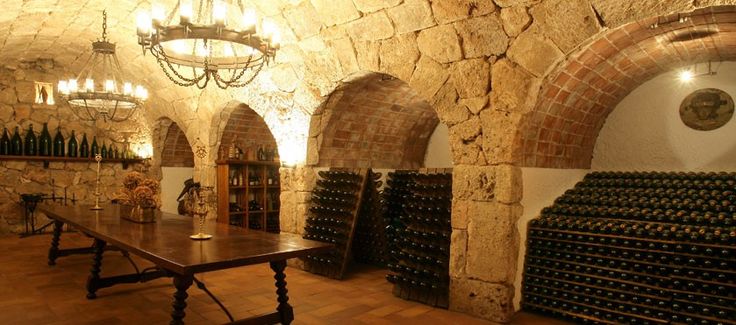
Locate an element on the screen. The height and width of the screenshot is (325, 736). table leg is located at coordinates (53, 250), (96, 268), (180, 304), (285, 295).